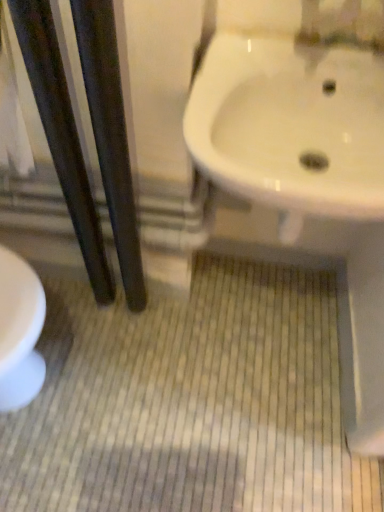
You are a GUI agent. You are given a task and a screenshot of the screen. Output one action in this format:
    pyautogui.click(x=<x>, y=<y>)
    Task: Click on the free space on the front side of dark wood pole at left, marked as the first pole in a left-to-right arrangement
    This screenshot has height=512, width=384.
    Given the screenshot: What is the action you would take?
    click(x=101, y=356)